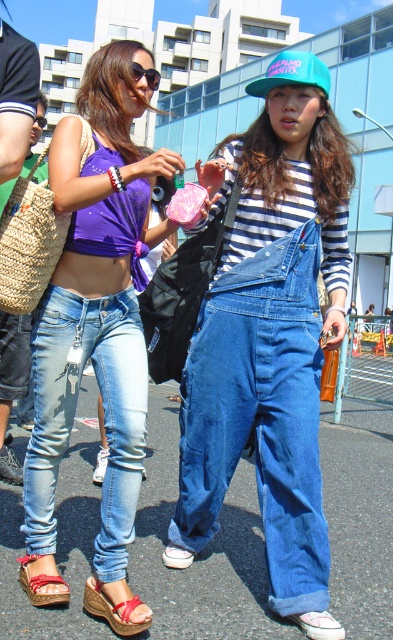
From the picture: You are standing at the point marked as point (x=110, y=618). You want to walk to the person on the left and then to the person on the right. What is the shortest total distance you need to walk?

The shortest total distance would be to first walk to the person on the left, then to the person on the right. Since they are 7.43 feet apart, the total distance would be the distance from the point to the left person plus the 7.43 feet between them.

You are a photographer trying to capture a candid shot of both individuals. Since the light blue denim jeans at lower left and the teal matte baseball cap at center are in your viewfinder, which object should you focus on first to ensure both are in frame?

The light blue denim jeans at lower left is located below the teal matte baseball cap at center, so focusing on the teal matte baseball cap at center first will help ensure both objects remain in frame as you adjust the shot.

You are a photographer setting up a shoot. You want to ensure that both the red leather wedge sandal at lower left and the pink fabric sandal at lower center are visible in your photo. Based on their current positions, which sandal is closer to the camera?

The red leather wedge sandal at lower left is closer to the camera because it is in front of the pink fabric sandal at lower center.